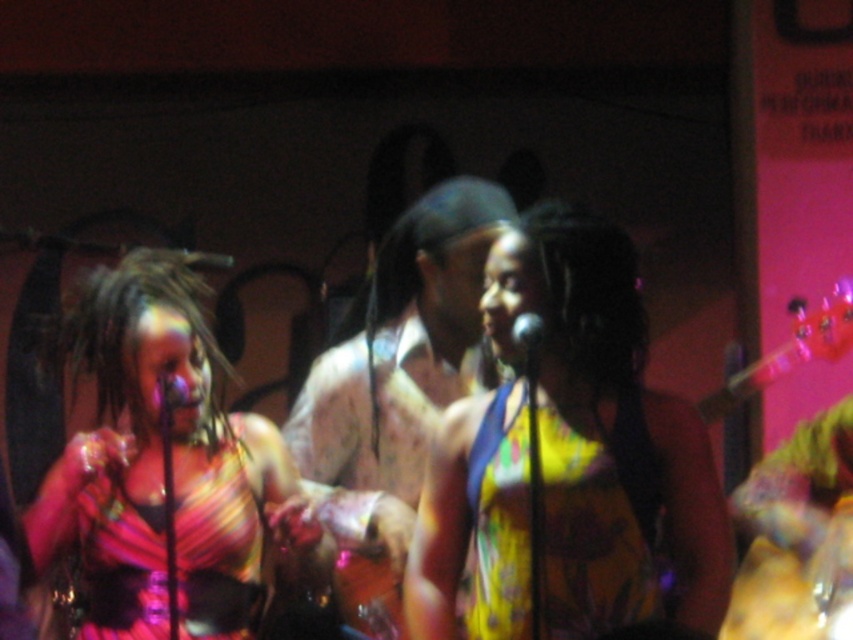
Between patterned fabric shirt at center and multicolored satin dress at center, which one appears on the left side from the viewer's perspective?

From the viewer's perspective, multicolored satin dress at center appears more on the left side.

Does patterned fabric shirt at center have a lesser width compared to multicolored satin dress at center?

Incorrect, patterned fabric shirt at center's width is not less than multicolored satin dress at center's.

The width and height of the screenshot is (853, 640). What are the coordinates of `patterned fabric shirt at center` in the screenshot? It's located at (396, 385).

Between multicolored satin dress at center and yellow printed fabric dress at center, which one is positioned lower?

Positioned lower is multicolored satin dress at center.

Which of these two, multicolored satin dress at center or yellow printed fabric dress at center, stands shorter?

With less height is yellow printed fabric dress at center.

Is point (193, 547) more distant than point (648, 588)?

Yes.

This screenshot has height=640, width=853. In order to click on multicolored satin dress at center in this screenshot , I will do `click(219, 552)`.

Does patterned fabric shirt at center appear on the right side of yellow printed fabric dress at center?

No, patterned fabric shirt at center is not to the right of yellow printed fabric dress at center.

Does patterned fabric shirt at center appear under yellow printed fabric dress at center?

No.

Identify the location of patterned fabric shirt at center. (396, 385).